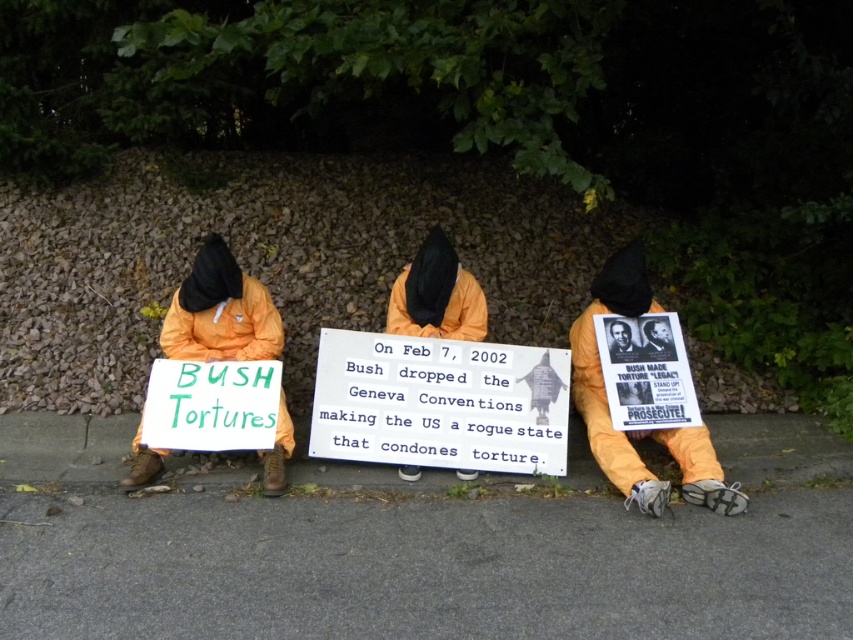
Question: Is orange fabric poster at center to the right of orange fabric sign at left from the viewer's perspective?

Choices:
 (A) no
 (B) yes

Answer: (B)

Question: Does orange fabric poster at center have a smaller size compared to orange fabric sign at left?

Choices:
 (A) yes
 (B) no

Answer: (B)

Question: Estimate the real-world distances between objects in this image. Which object is farther from the orange fabric poster at center?

Choices:
 (A) orange fabric hood at center
 (B) orange fabric sign at left

Answer: (B)

Question: Considering the real-world distances, which object is closest to the orange fabric hood at center?

Choices:
 (A) orange fabric poster at center
 (B) orange fabric sign at left

Answer: (B)

Question: Which point is closer to the camera taking this photo?

Choices:
 (A) (637, 284)
 (B) (434, 310)
 (C) (206, 250)

Answer: (C)

Question: Where is orange fabric sign at left located in relation to orange fabric hood at center in the image?

Choices:
 (A) above
 (B) below

Answer: (B)